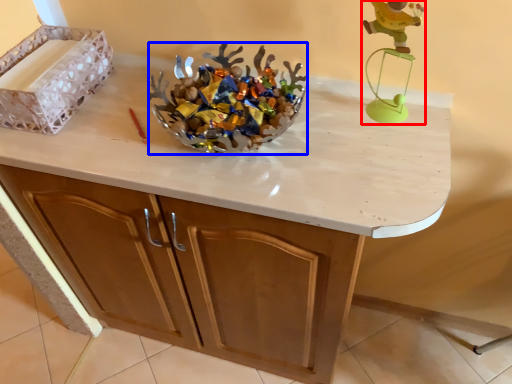
Question: Which object appears farthest to the camera in this image, toy (highlighted by a red box) or stuff (highlighted by a blue box)?

Choices:
 (A) toy
 (B) stuff

Answer: (B)